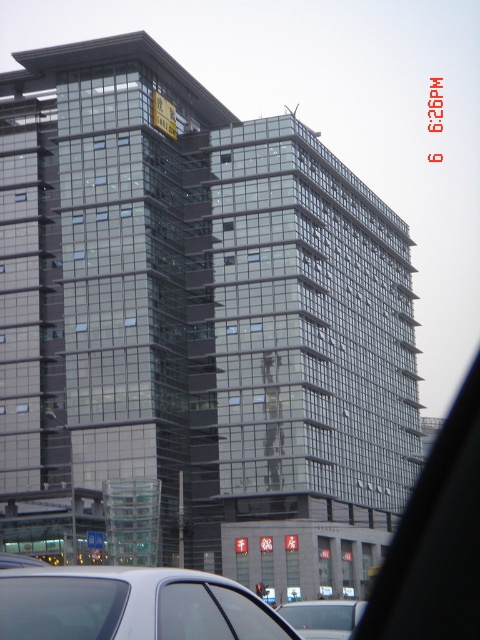
Question: Which of the following is the closest to the observer?

Choices:
 (A) transparent glass car window at lower left
 (B) white matte car at lower center
 (C) transparent glass car window at lower center
 (D) silver metallic car at lower left

Answer: (A)

Question: Is transparent glass car window at lower left to the right of transparent glass car window at lower center from the viewer's perspective?

Choices:
 (A) yes
 (B) no

Answer: (B)

Question: Which point is farther to the camera?

Choices:
 (A) transparent glass car window at lower center
 (B) white matte car at lower center
 (C) transparent glass car window at lower left
 (D) silver metallic car at lower left

Answer: (B)

Question: Which of these objects is positioned farthest from the transparent glass car window at lower center?

Choices:
 (A) white matte car at lower center
 (B) silver metallic car at lower left
 (C) transparent glass car window at lower left

Answer: (A)

Question: Observing the image, what is the correct spatial positioning of silver metallic car at lower left in reference to white matte car at lower center?

Choices:
 (A) left
 (B) right

Answer: (A)

Question: Is silver metallic car at lower left bigger than transparent glass car window at lower center?

Choices:
 (A) yes
 (B) no

Answer: (A)